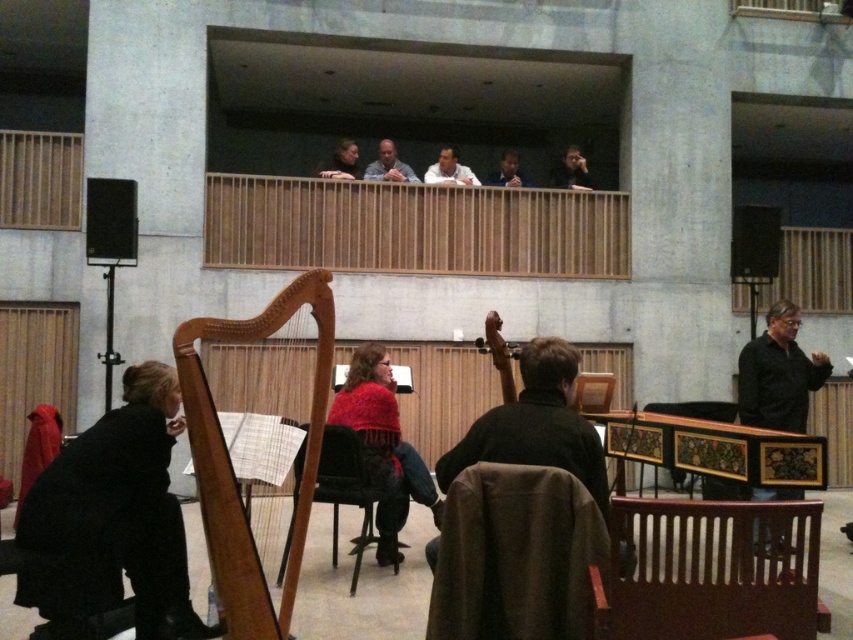
You are a stagehand setting up a music hall. You need to move the wooden harp at lower left and the brown fabric chair at center to the storage room. Which object should you move first if you want to move the larger item first?

The wooden harp at lower left should be moved first because it has a larger size compared to the brown fabric chair at center.

You are a photographer setting up a shot in the concert hall. You want to capture both the wooden chair at center and the white shirt at upper center in the same frame. Which object should you position your camera closer to in order to include both in the shot?

The wooden chair at center is positioned on the right side of white shirt at upper center. To include both in the shot, the camera should be positioned closer to the white shirt at upper center so that the wooden chair at center can be captured on its right side.